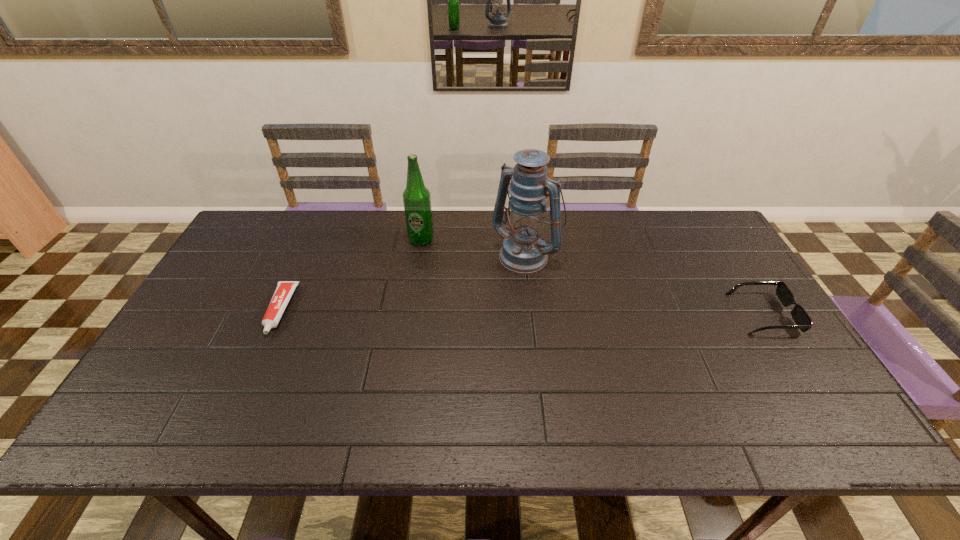
Identify the location of vacant region at the left edge of the desktop. Image resolution: width=960 pixels, height=540 pixels. pyautogui.click(x=217, y=286).

The height and width of the screenshot is (540, 960). I want to click on vacant region at the right edge of the desktop, so click(732, 305).

Locate an element on the screen. The height and width of the screenshot is (540, 960). vacant space at the far left corner of the desktop is located at coordinates (261, 229).

This screenshot has height=540, width=960. In the image, there is a desktop. What are the coordinates of `vacant space at the far right corner` in the screenshot? It's located at (705, 217).

You are a GUI agent. You are given a task and a screenshot of the screen. Output one action in this format:
    pyautogui.click(x=<x>, y=<y>)
    Task: Click on the vacant point located between the leftmost object and the second object from left to right
    Image resolution: width=960 pixels, height=540 pixels.
    Given the screenshot: What is the action you would take?
    pyautogui.click(x=350, y=275)

Find the location of a particular element. The image size is (960, 540). free space between the tallest object and the toothpaste is located at coordinates (403, 282).

At what (x,y) coordinates should I click in order to perform the action: click on vacant area that lies between the second shortest object and the beer bottle. Please return your answer as a coordinate pair (x, y). Looking at the image, I should click on (592, 276).

I want to click on free space between the rightmost object and the lantern, so click(x=645, y=284).

Find the location of a particular element. vacant space in between the third shortest object and the tallest object is located at coordinates (474, 246).

You are a GUI agent. You are given a task and a screenshot of the screen. Output one action in this format:
    pyautogui.click(x=<x>, y=<y>)
    Task: Click on the vacant space in between the leftmost object and the rightmost object
    This screenshot has width=960, height=540.
    Given the screenshot: What is the action you would take?
    pyautogui.click(x=521, y=312)